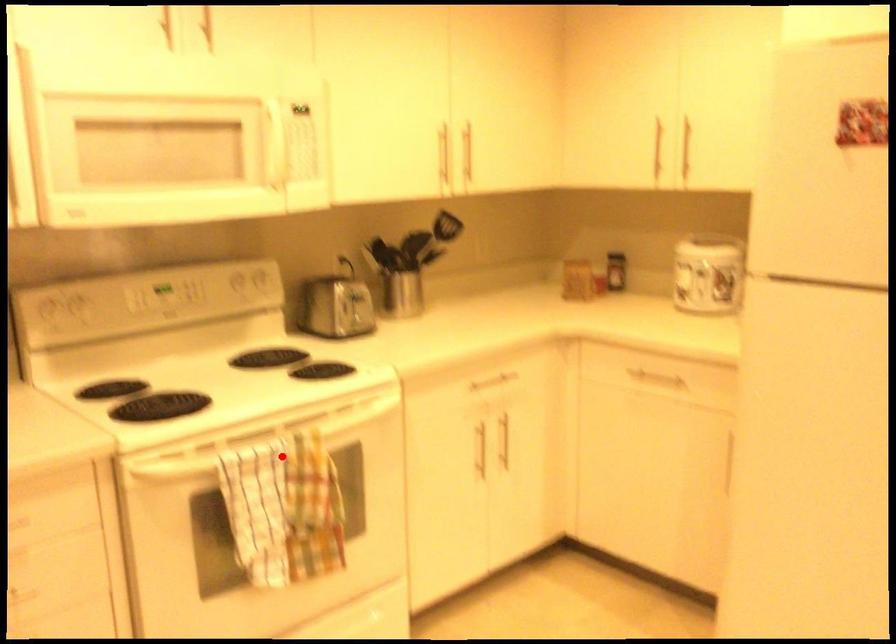
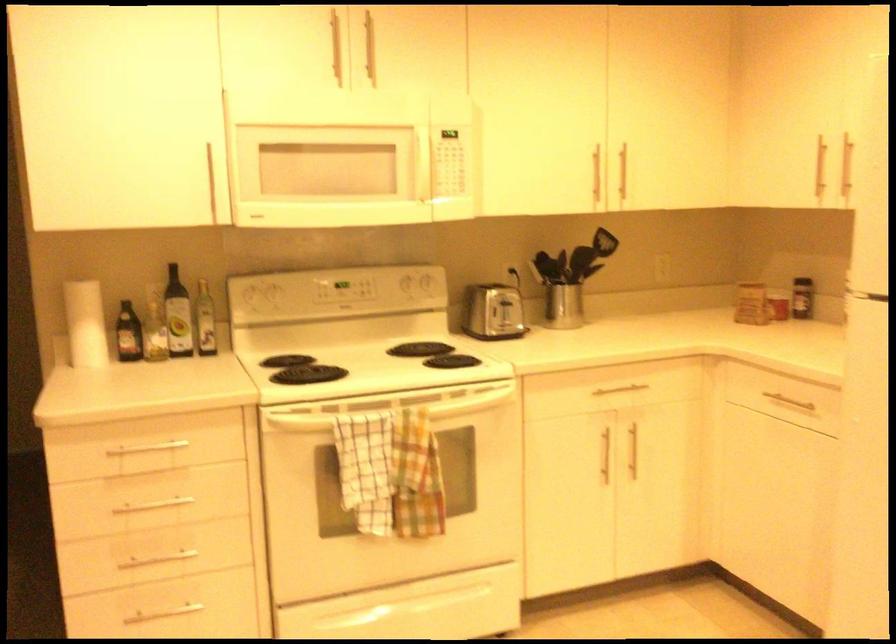
Question: A red point is marked in image1. In image2, is the corresponding 3D point closer to the camera or farther? Reply with the corresponding letter.

Choices:
 (A) The corresponding 3D point is closer.
 (B) The corresponding 3D point is farther.

Answer: (B)